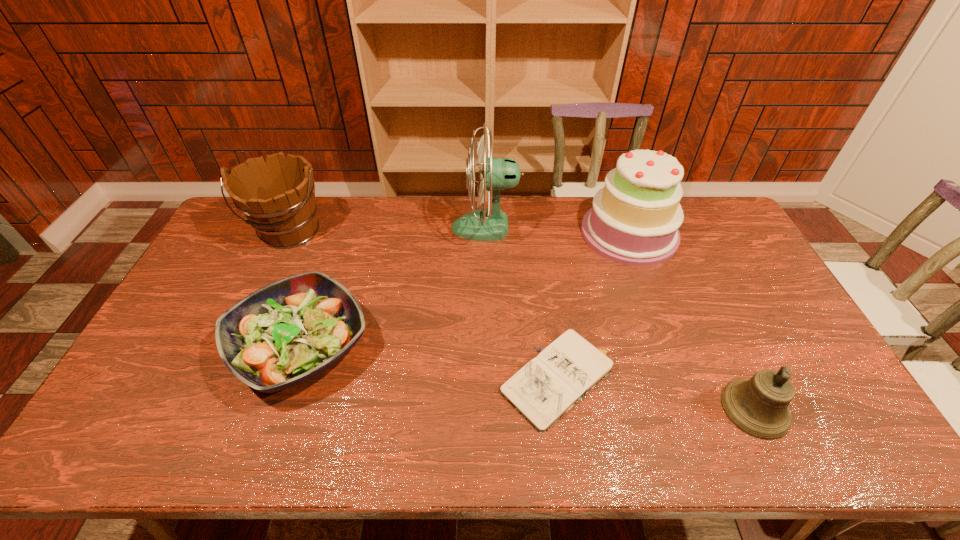
Locate which object is the third closest to the salad plate. Please provide its 2D coordinates. Your answer should be formatted as a tuple, i.e. [(x, y)], where the tuple contains the x and y coordinates of a point satisfying the conditions above.

[(548, 386)]

You are a GUI agent. You are given a task and a screenshot of the screen. Output one action in this format:
    pyautogui.click(x=<x>, y=<y>)
    Task: Click on the free space in the image that satisfies the following two spatial constraints: 1. in front of the fan, directing airflow; 2. with the handle on the wine bucket
    
    Given the screenshot: What is the action you would take?
    pyautogui.click(x=486, y=231)

This screenshot has height=540, width=960. What are the coordinates of `free space that satisfies the following two spatial constraints: 1. in front of the bell, directing airflow; 2. on the right side of the tallest object` in the screenshot? It's located at (488, 409).

You are a GUI agent. You are given a task and a screenshot of the screen. Output one action in this format:
    pyautogui.click(x=<x>, y=<y>)
    Task: Click on the free space that satisfies the following two spatial constraints: 1. on the back side of the cake; 2. on the left side of the second shortest object
    Image resolution: width=960 pixels, height=540 pixels.
    Given the screenshot: What is the action you would take?
    pyautogui.click(x=340, y=233)

At what (x,y) coordinates should I click in order to perform the action: click on free spot that satisfies the following two spatial constraints: 1. on the back side of the bell; 2. in front of the fan, directing airflow. Please return your answer as a coordinate pair (x, y). This screenshot has height=540, width=960. Looking at the image, I should click on (671, 227).

At what (x,y) coordinates should I click in order to perform the action: click on vacant area that satisfies the following two spatial constraints: 1. with the handle on the wine bucket; 2. on the left side of the cake. Please return your answer as a coordinate pair (x, y). This screenshot has width=960, height=540. Looking at the image, I should click on (289, 233).